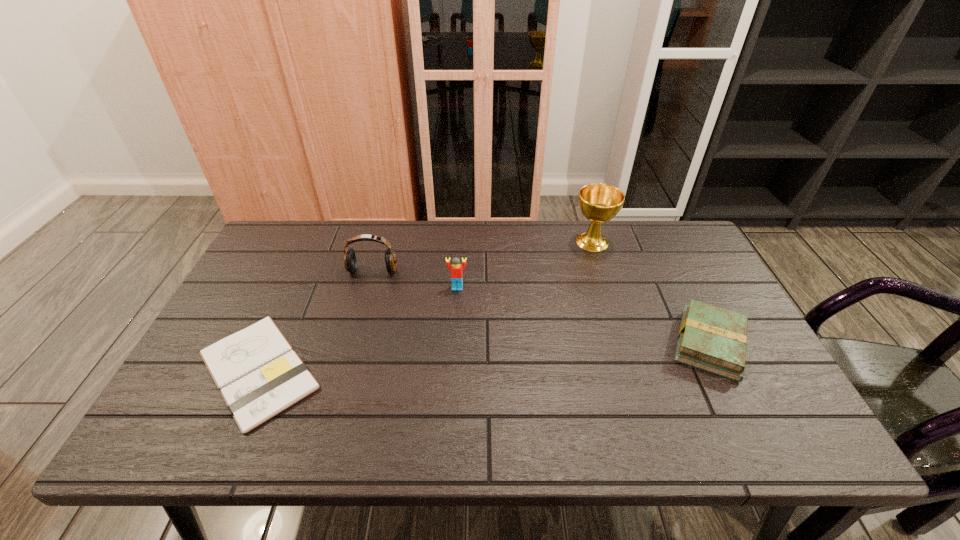
The height and width of the screenshot is (540, 960). I want to click on vacant position located 0.130m on the ear cups of the second tallest object, so coord(362,309).

Where is `vacant space located 0.060m on the face of the third shortest object`? This screenshot has height=540, width=960. vacant space located 0.060m on the face of the third shortest object is located at coordinates (456, 306).

You are a GUI agent. You are given a task and a screenshot of the screen. Output one action in this format:
    pyautogui.click(x=<x>, y=<y>)
    Task: Click on the vacant space situated 0.290m on the back of the rightmost object
    This screenshot has width=960, height=540.
    Given the screenshot: What is the action you would take?
    pyautogui.click(x=661, y=246)

Locate an element on the screen. The width and height of the screenshot is (960, 540). vacant space located on the back of the notepad is located at coordinates (306, 265).

Locate an element on the screen. This screenshot has height=540, width=960. chalice situated at the far edge is located at coordinates (599, 203).

Image resolution: width=960 pixels, height=540 pixels. I want to click on headset that is at the far edge, so click(350, 262).

I want to click on object located at the near edge, so click(259, 375).

The width and height of the screenshot is (960, 540). I want to click on object present at the left edge, so click(x=259, y=375).

Where is `object located at the right edge`? Image resolution: width=960 pixels, height=540 pixels. object located at the right edge is located at coordinates (712, 339).

Identify the location of object located in the near left corner section of the desktop. The width and height of the screenshot is (960, 540). (259, 375).